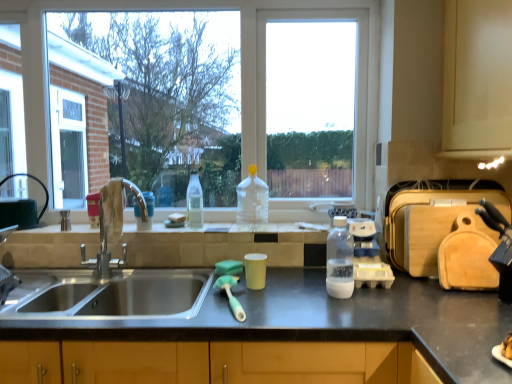
Question: From a real-world perspective, is clear plastic bottle at center, acting as the first bottle starting from the back, on top of stainless steel sink at left?

Choices:
 (A) no
 (B) yes

Answer: (B)

Question: Considering the relative positions of clear plastic bottle at center, which appears as the 3th bottle when viewed from the right, and stainless steel sink at left in the image provided, is clear plastic bottle at center, which appears as the 3th bottle when viewed from the right, to the right of stainless steel sink at left from the viewer's perspective?

Choices:
 (A) yes
 (B) no

Answer: (A)

Question: Can you confirm if clear plastic bottle at center, placed as the 1th bottle when sorted from left to right, is wider than stainless steel sink at left?

Choices:
 (A) no
 (B) yes

Answer: (A)

Question: From the image's perspective, is clear plastic bottle at center, marked as the 3th bottle in a front-to-back arrangement, below stainless steel sink at left?

Choices:
 (A) no
 (B) yes

Answer: (A)

Question: Is clear plastic bottle at center, which appears as the 3th bottle when viewed from the right, next to stainless steel sink at left?

Choices:
 (A) no
 (B) yes

Answer: (A)

Question: Considering the relative sizes of clear plastic bottle at center, marked as the 3th bottle in a front-to-back arrangement, and stainless steel sink at left in the image provided, is clear plastic bottle at center, marked as the 3th bottle in a front-to-back arrangement, shorter than stainless steel sink at left?

Choices:
 (A) no
 (B) yes

Answer: (B)

Question: Is transparent plastic bottle at center, which ranks as the third bottle in left-to-right order, oriented towards wooden cutting board at right, which ranks as the first appliance in right-to-left order?

Choices:
 (A) yes
 (B) no

Answer: (A)

Question: Is transparent plastic bottle at center, the first bottle positioned from the right, positioned beyond the bounds of wooden cutting board at right, which is the second appliance from left to right?

Choices:
 (A) no
 (B) yes

Answer: (B)

Question: Is transparent plastic bottle at center, which ranks as the third bottle in left-to-right order, smaller than wooden cutting board at right, which is the second appliance from left to right?

Choices:
 (A) yes
 (B) no

Answer: (A)

Question: Does transparent plastic bottle at center, which ranks as the third bottle in left-to-right order, appear on the left side of wooden cutting board at right, which ranks as the first appliance in right-to-left order?

Choices:
 (A) yes
 (B) no

Answer: (A)

Question: Is transparent plastic bottle at center, which ranks as the third bottle in left-to-right order, wider than wooden cutting board at right, which is the second appliance from left to right?

Choices:
 (A) no
 (B) yes

Answer: (A)

Question: Are transparent plastic bottle at center, the first bottle positioned from the right, and wooden cutting board at right, which is the second appliance from left to right, located far from each other?

Choices:
 (A) yes
 (B) no

Answer: (B)

Question: Does wooden cutting board at right, which ranks as the first appliance in right-to-left order, contain clear glass screen door at left?

Choices:
 (A) no
 (B) yes

Answer: (A)